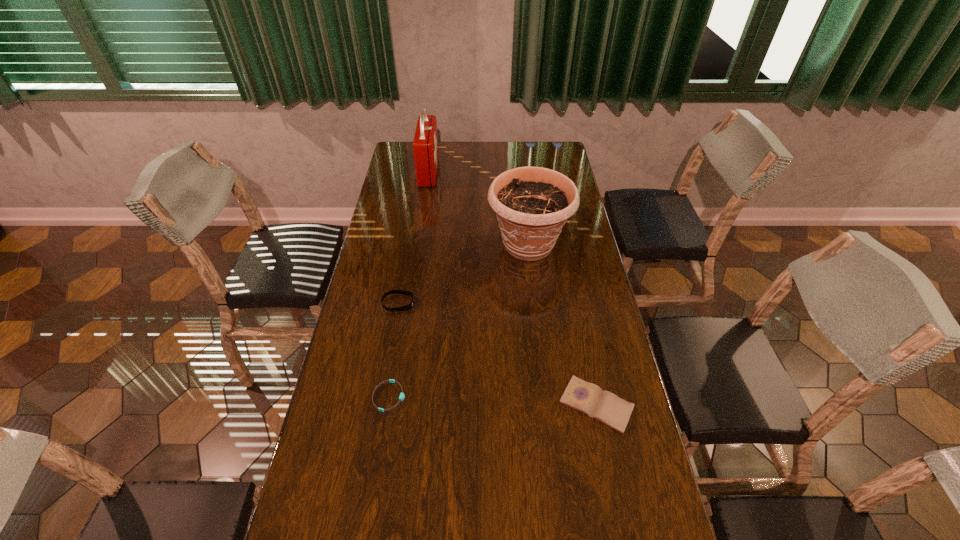
Where is `free space located 0.050m on the display of the farther wristband`? This screenshot has height=540, width=960. free space located 0.050m on the display of the farther wristband is located at coordinates (430, 303).

The image size is (960, 540). I want to click on vacant space situated 0.140m on the front of the second shortest object, so click(614, 491).

You are a GUI agent. You are given a task and a screenshot of the screen. Output one action in this format:
    pyautogui.click(x=<x>, y=<y>)
    Task: Click on the free space located on the buckle of the shorter wristband
    This screenshot has height=540, width=960.
    Given the screenshot: What is the action you would take?
    pyautogui.click(x=511, y=396)

Identify the location of object that is positioned at the far edge. (425, 144).

I want to click on the first-aid kit present at the left edge, so click(425, 144).

Find the location of a particular element. flowerpot at the right edge is located at coordinates (532, 204).

This screenshot has height=540, width=960. What are the coordinates of `diary that is at the right edge` in the screenshot? It's located at (586, 397).

What are the coordinates of `object at the far left corner` in the screenshot? It's located at (425, 144).

In the image, there is a desktop. In order to click on vacant space at the far edge in this screenshot , I will do click(462, 160).

Where is `vacant space at the left edge of the desktop`? The image size is (960, 540). vacant space at the left edge of the desktop is located at coordinates (351, 491).